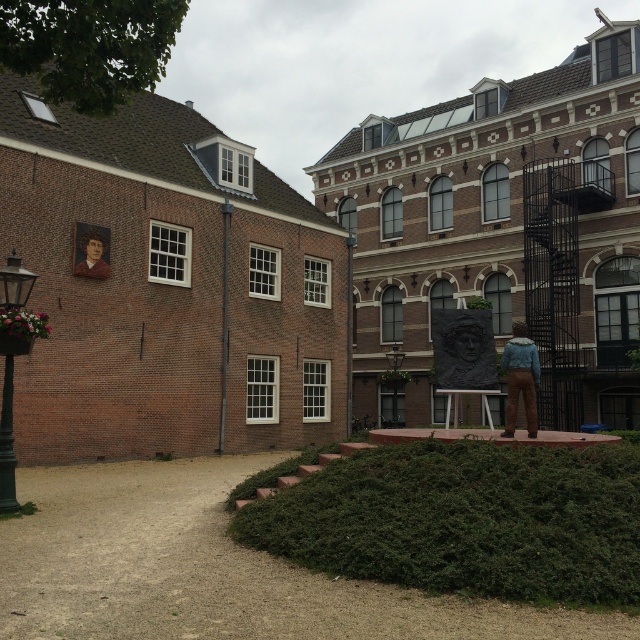
Based on the photo, can you confirm if black stone relief at center is positioned above black metal pole at center?

No, black stone relief at center is not above black metal pole at center.

Who is positioned more to the right, black stone relief at center or black metal pole at center?

black stone relief at center is more to the right.

You are a GUI agent. You are given a task and a screenshot of the screen. Output one action in this format:
    pyautogui.click(x=<x>, y=<y>)
    Task: Click on the black stone relief at center
    The height and width of the screenshot is (640, 640).
    Given the screenshot: What is the action you would take?
    pyautogui.click(x=464, y=349)

Looking at this image, can you confirm if green painted metal streetlamp at left is bigger than brown brick pole at center?

Incorrect, green painted metal streetlamp at left is not larger than brown brick pole at center.

This screenshot has width=640, height=640. What do you see at coordinates (8, 420) in the screenshot?
I see `green painted metal streetlamp at left` at bounding box center [8, 420].

This screenshot has height=640, width=640. Describe the element at coordinates (8, 420) in the screenshot. I see `green painted metal streetlamp at left` at that location.

Locate an element on the screen. This screenshot has height=640, width=640. green painted metal streetlamp at left is located at coordinates (8, 420).

Which is more to the right, blue denim jacket at lower right or brown brick pole at center?

blue denim jacket at lower right

Is blue denim jacket at lower right thinner than brown brick pole at center?

No, blue denim jacket at lower right is not thinner than brown brick pole at center.

Which is in front, point (532, 419) or point (221, 282)?

Point (532, 419) is more forward.

I want to click on blue denim jacket at lower right, so click(x=520, y=378).